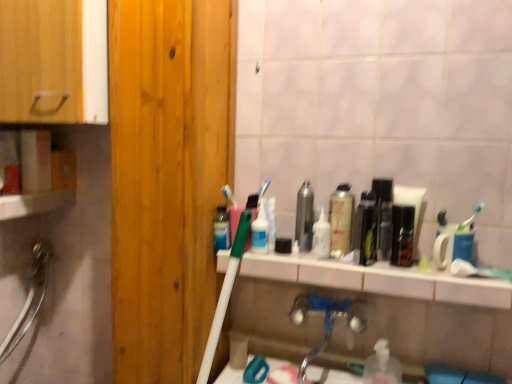
Question: Is light brown wood door at left positioned in front of silver metallic faucet at lower center?

Choices:
 (A) no
 (B) yes

Answer: (B)

Question: Is the depth of light brown wood door at left greater than that of silver metallic faucet at lower center?

Choices:
 (A) yes
 (B) no

Answer: (B)

Question: Is light brown wood door at left thinner than silver metallic faucet at lower center?

Choices:
 (A) yes
 (B) no

Answer: (B)

Question: Is light brown wood door at left beside silver metallic faucet at lower center?

Choices:
 (A) no
 (B) yes

Answer: (A)

Question: Does light brown wood door at left appear on the right side of silver metallic faucet at lower center?

Choices:
 (A) yes
 (B) no

Answer: (B)

Question: Considering their positions, is metallic can at center, acting as the 4th mouthwash starting from the right, located in front of or behind wooden cabinet at left?

Choices:
 (A) behind
 (B) front

Answer: (A)

Question: From a real-world perspective, is metallic can at center, which appears as the third mouthwash when viewed from the left, above or below wooden cabinet at left?

Choices:
 (A) below
 (B) above

Answer: (A)

Question: From their relative heights in the image, would you say metallic can at center, which appears as the third mouthwash when viewed from the left, is taller or shorter than wooden cabinet at left?

Choices:
 (A) tall
 (B) short

Answer: (B)

Question: Is metallic can at center, which appears as the third mouthwash when viewed from the left, to the left or to the right of wooden cabinet at left in the image?

Choices:
 (A) left
 (B) right

Answer: (B)

Question: Looking at the image, does blue glossy bottle at center, the first mouthwash positioned from the left, seem bigger or smaller compared to white glossy toothpaste tube at center, which ranks as the 1th toiletry in left-to-right order?

Choices:
 (A) small
 (B) big

Answer: (A)

Question: From the image's perspective, is blue glossy bottle at center, the first mouthwash positioned from the left, positioned above or below white glossy toothpaste tube at center, which ranks as the 1th toiletry in left-to-right order?

Choices:
 (A) above
 (B) below

Answer: (A)

Question: Is blue glossy bottle at center, the first mouthwash positioned from the left, wider or thinner than white glossy toothpaste tube at center, which ranks as the 1th toiletry in left-to-right order?

Choices:
 (A) wide
 (B) thin

Answer: (B)

Question: From a real-world perspective, is blue glossy bottle at center, the first mouthwash positioned from the left, positioned above or below white glossy toothpaste tube at center, which ranks as the 1th toiletry in left-to-right order?

Choices:
 (A) below
 (B) above

Answer: (B)

Question: Based on their positions, is green plastic mouthwash at center, which appears as the fifth mouthwash when viewed from the right, located to the left or right of white glossy counter top at center?

Choices:
 (A) right
 (B) left

Answer: (B)

Question: From a real-world perspective, relative to white glossy counter top at center, is green plastic mouthwash at center, the second mouthwash when ordered from left to right, vertically above or below?

Choices:
 (A) below
 (B) above

Answer: (B)